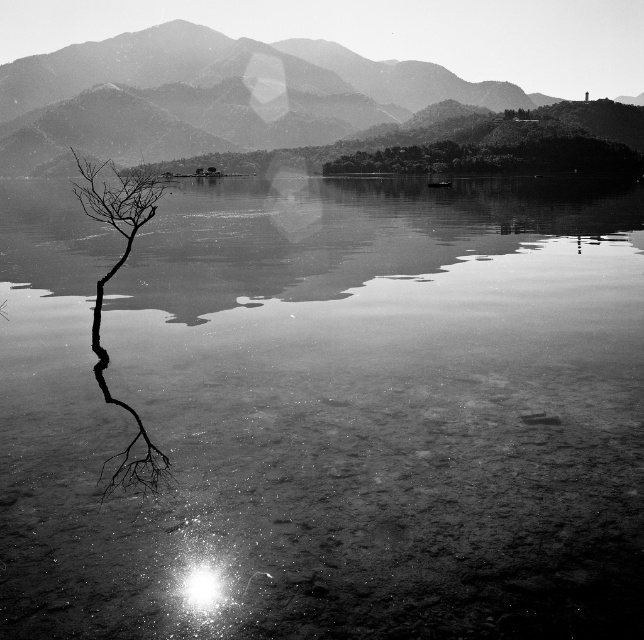
You are standing at the lakeside and see the smooth water at center and the smooth stone mountain at upper center. Which object is positioned to the right side of the other?

The smooth water at center is to the right of the smooth stone mountain at upper center.

You are an artist sketching this lakeside scene. You want to draw the smooth stone mountain at upper center and the black matte tree at left accurately. Which object should you sketch first to maintain proper spatial relationships?

You should sketch the smooth stone mountain at upper center first because it is closer to the viewer than the black matte tree at left, so it should be placed in front in the composition.